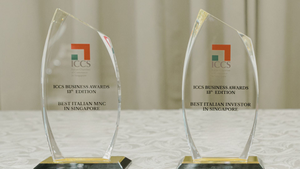
You are a GUI agent. You are given a task and a screenshot of the screen. Output one action in this format:
    pyautogui.click(x=<x>, y=<y>)
    Task: Click on the trophy
    This screenshot has height=169, width=300.
    Given the screenshot: What is the action you would take?
    pyautogui.click(x=238, y=71)